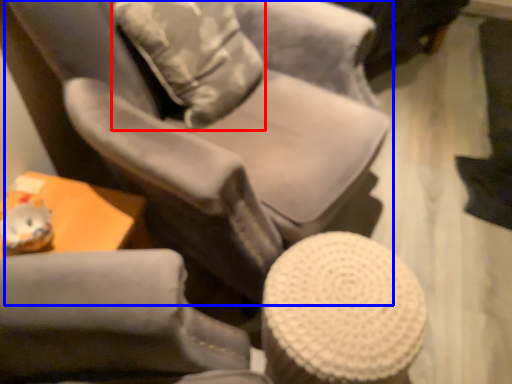
Question: Which object appears farthest to the camera in this image, throw pillow (highlighted by a red box) or chair (highlighted by a blue box)?

Choices:
 (A) throw pillow
 (B) chair

Answer: (A)